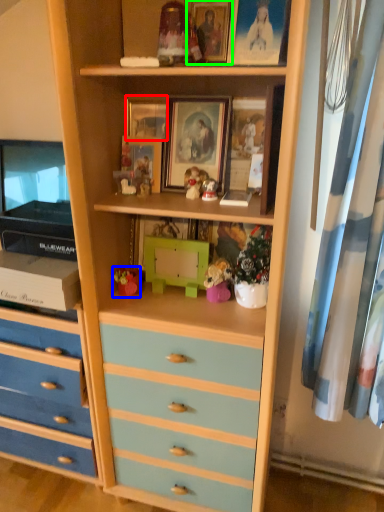
Question: Which object is positioned farthest from picture frame (highlighted by a red box)? Select from toy (highlighted by a blue box) and picture frame (highlighted by a green box).

Choices:
 (A) toy
 (B) picture frame

Answer: (A)